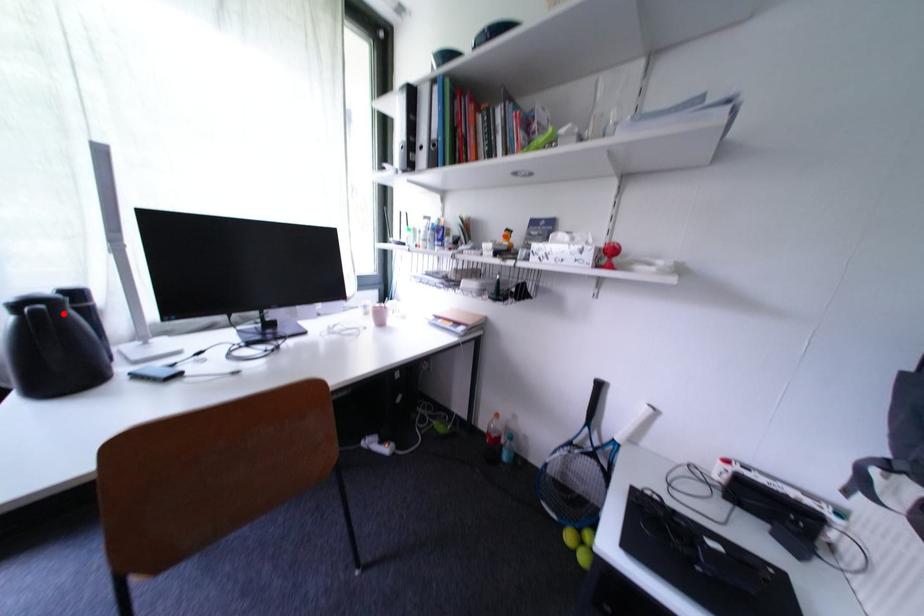
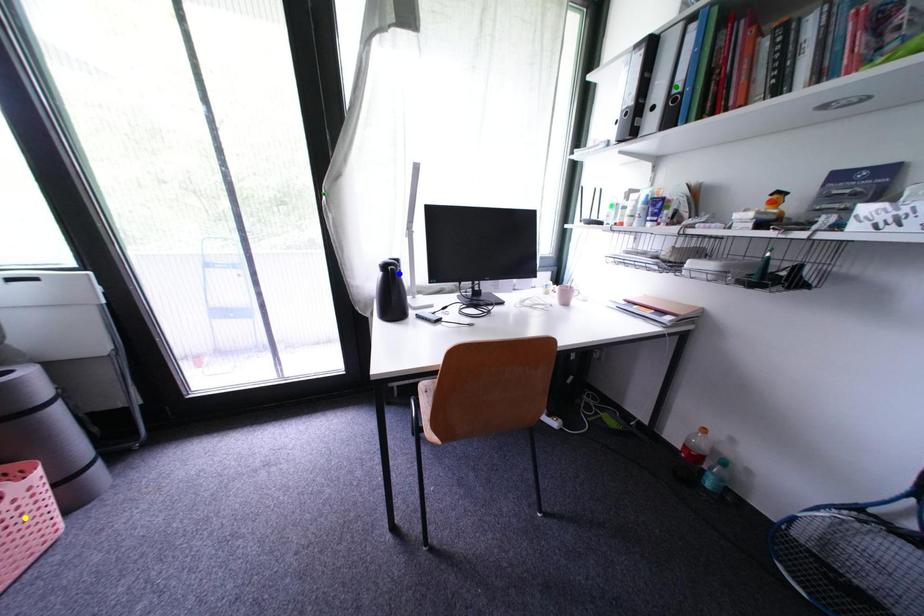
Question: I am providing you with two images of the same scene from different viewpoints. A red point is marked on the first image. You are given multiple points on the second image. Which mark in image 2 goes with the point in image 1?

Choices:
 (A) green point
 (B) blue point
 (C) yellow point

Answer: (B)